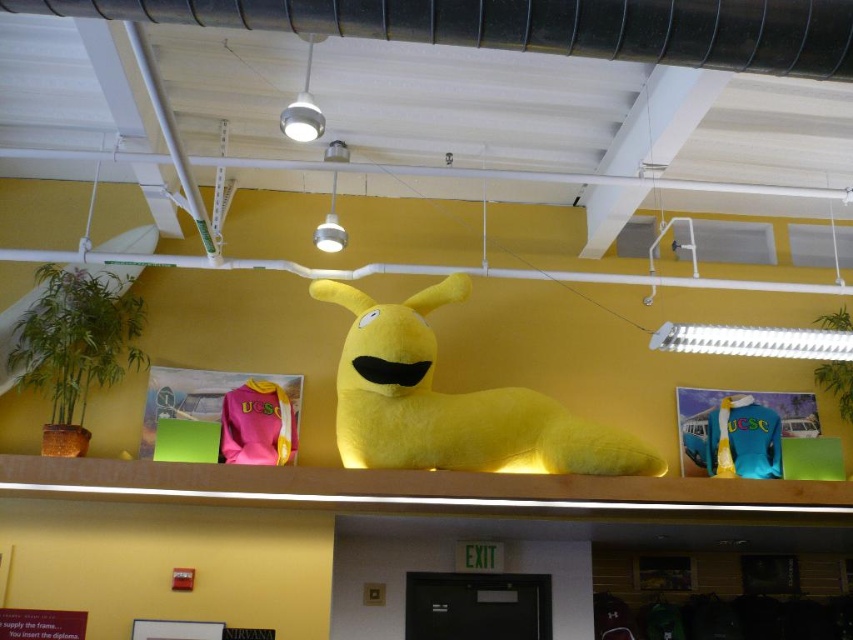
Question: Where is matte yellow plush at center located in relation to pink fleece sweatshirt at center in the image?

Choices:
 (A) right
 (B) left

Answer: (A)

Question: Which point is closer to the camera taking this photo?

Choices:
 (A) (714, 435)
 (B) (227, 401)
 (C) (314, 288)

Answer: (B)

Question: Does matte yellow plush at center appear on the left side of blue fabric shirt at upper center?

Choices:
 (A) no
 (B) yes

Answer: (B)

Question: Based on their relative distances, which object is farther from the matte yellow plush at center?

Choices:
 (A) blue fabric shirt at upper center
 (B) pink fleece sweatshirt at center

Answer: (A)

Question: Does matte yellow plush at center lie in front of pink fleece sweatshirt at center?

Choices:
 (A) yes
 (B) no

Answer: (A)

Question: Which object is positioned farthest from the blue fabric shirt at upper center?

Choices:
 (A) matte yellow plush at center
 (B) pink fleece sweatshirt at center

Answer: (B)